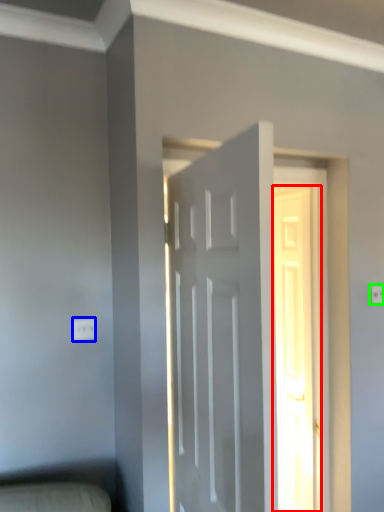
Question: Which is farther away from door (highlighted by a red box)? electric outlet (highlighted by a blue box) or electric outlet (highlighted by a green box)?

Choices:
 (A) electric outlet
 (B) electric outlet

Answer: (A)